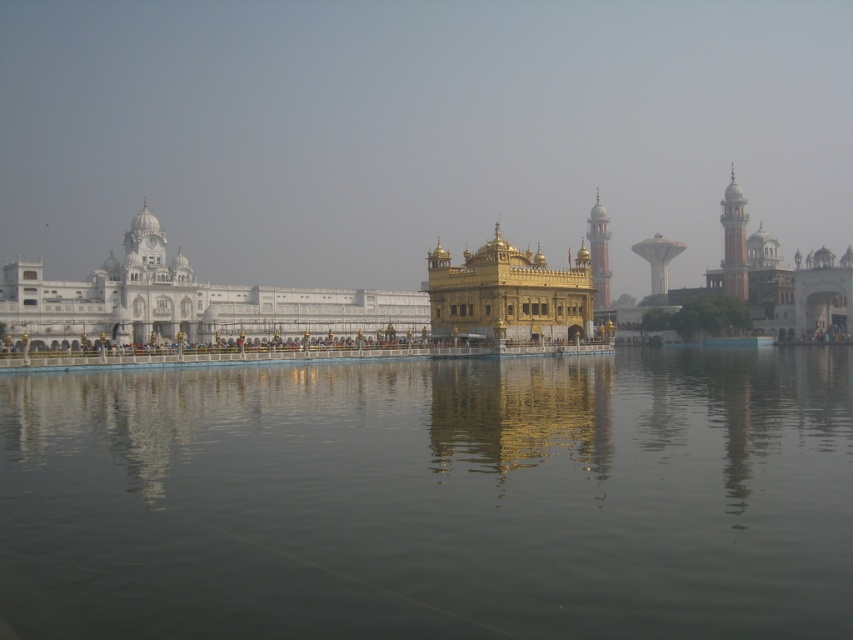
You are a tourist standing on the walkway leading to the Golden Temple. You see the transparent water at center and the golden polished temple at center. Which object is located to the left of the other?

The transparent water at center is positioned on the left side of golden polished temple at center.

Consider the image. You are a photographer planning to capture the reflection of the golden polished temple at center in the transparent water at center. Based on the scene, can you confirm if the reflection will be visible?

The transparent water at center is positioned under the golden polished temple at center, so the reflection of the golden polished temple at center will be visible in the transparent water at center.